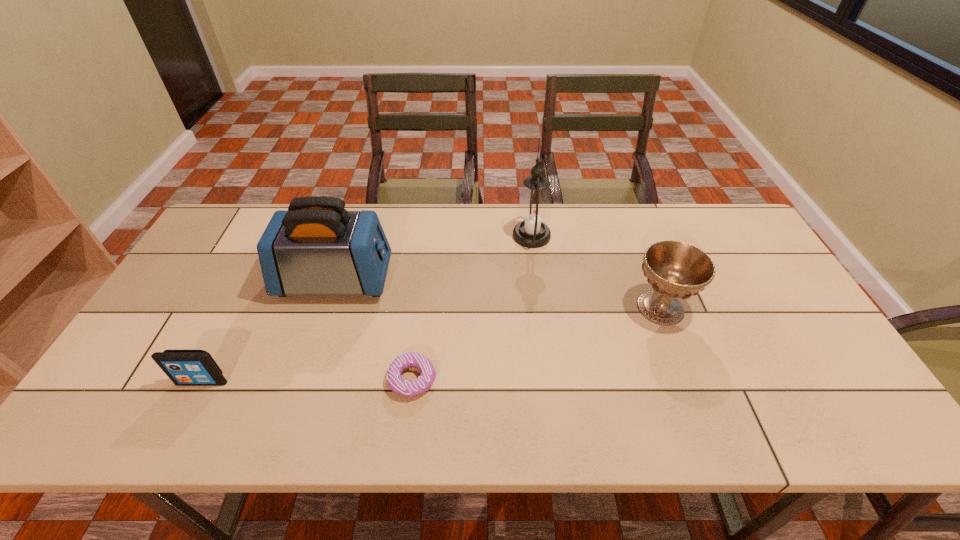
Find the location of a particular element. The height and width of the screenshot is (540, 960). free space between the fourth object from left to right and the rightmost object is located at coordinates (596, 272).

The image size is (960, 540). I want to click on empty space between the doughnut and the fourth object from left to right, so click(x=472, y=308).

Identify the location of unoccupied area between the second object from right to left and the leftmost object. This screenshot has height=540, width=960. (367, 309).

Select which object is the closest to the toaster. Please provide its 2D coordinates. Your answer should be formatted as a tuple, i.e. [(x, y)], where the tuple contains the x and y coordinates of a point satisfying the conditions above.

[(405, 388)]

Image resolution: width=960 pixels, height=540 pixels. What are the coordinates of `object that stands as the fourth closest to the fourth tallest object` in the screenshot? It's located at (674, 269).

Find the location of a particular element. vacant region that satisfies the following two spatial constraints: 1. on the back side of the third object from left to right; 2. on the front-facing side of the fourth shortest object is located at coordinates (424, 280).

This screenshot has height=540, width=960. What are the coordinates of `blank space that satisfies the following two spatial constraints: 1. on the back side of the shortest object; 2. on the front-facing side of the toaster` in the screenshot? It's located at (424, 280).

The width and height of the screenshot is (960, 540). Find the location of `free location that satisfies the following two spatial constraints: 1. on the front side of the tallest object; 2. on the front-facing side of the toaster`. free location that satisfies the following two spatial constraints: 1. on the front side of the tallest object; 2. on the front-facing side of the toaster is located at coordinates (538, 280).